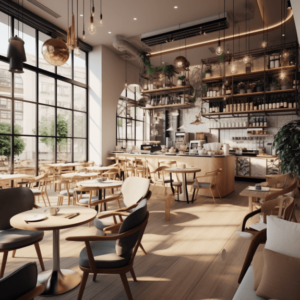
Find the location of `wall shelves behind counter`. wall shelves behind counter is located at coordinates (232, 127), (230, 112), (214, 97), (216, 77), (173, 87), (169, 105), (264, 134).